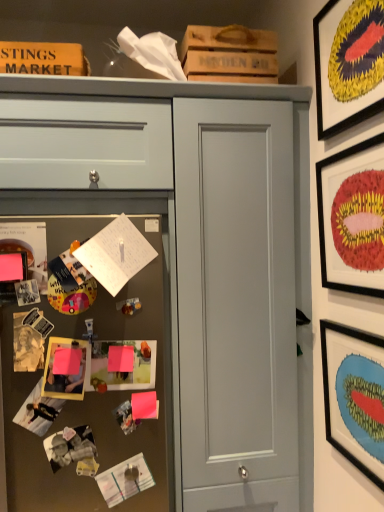
Question: Does matte black picture frame at upper right, the third picture frame viewed from the right, have a greater height compared to matte gray drawer at upper left?

Choices:
 (A) yes
 (B) no

Answer: (B)

Question: Does matte black picture frame at upper right, the third picture frame ordered from the bottom, have a greater width compared to matte gray drawer at upper left?

Choices:
 (A) no
 (B) yes

Answer: (A)

Question: Is matte black picture frame at upper right, the third picture frame viewed from the right, far away from matte gray drawer at upper left?

Choices:
 (A) no
 (B) yes

Answer: (A)

Question: Are matte black picture frame at upper right, the third picture frame ordered from the bottom, and matte gray drawer at upper left making contact?

Choices:
 (A) yes
 (B) no

Answer: (B)

Question: From a real-world perspective, is matte black picture frame at upper right, the third picture frame ordered from the bottom, physically above matte gray drawer at upper left?

Choices:
 (A) no
 (B) yes

Answer: (A)

Question: From the image's perspective, is metallic silver fridge at left above or below matte gray drawer at upper left?

Choices:
 (A) below
 (B) above

Answer: (A)

Question: Visually, is metallic silver fridge at left positioned to the left or to the right of matte gray drawer at upper left?

Choices:
 (A) right
 (B) left

Answer: (A)

Question: Is metallic silver fridge at left in front of or behind matte gray drawer at upper left in the image?

Choices:
 (A) front
 (B) behind

Answer: (A)

Question: In terms of height, does metallic silver fridge at left look taller or shorter compared to matte gray drawer at upper left?

Choices:
 (A) tall
 (B) short

Answer: (A)

Question: Relative to matte gray door at center, is matte black picture frame at upper right, the third picture frame viewed from the right, in front or behind?

Choices:
 (A) front
 (B) behind

Answer: (A)

Question: From a real-world perspective, relative to matte gray door at center, is matte black picture frame at upper right, marked as the 2th picture frame in a top-to-bottom arrangement, vertically above or below?

Choices:
 (A) above
 (B) below

Answer: (A)

Question: Choose the correct answer: Is matte black picture frame at upper right, marked as the 2th picture frame in a top-to-bottom arrangement, inside matte gray door at center or outside it?

Choices:
 (A) inside
 (B) outside

Answer: (B)

Question: From the image's perspective, is matte black picture frame at upper right, the third picture frame viewed from the right, positioned above or below matte gray door at center?

Choices:
 (A) above
 (B) below

Answer: (A)

Question: Is point (344, 285) positioned closer to the camera than point (135, 501)?

Choices:
 (A) farther
 (B) closer

Answer: (B)

Question: Visually, is matte black picture frame at upper right, marked as the 2th picture frame in a top-to-bottom arrangement, positioned to the left or to the right of metallic silver fridge at left?

Choices:
 (A) left
 (B) right

Answer: (B)